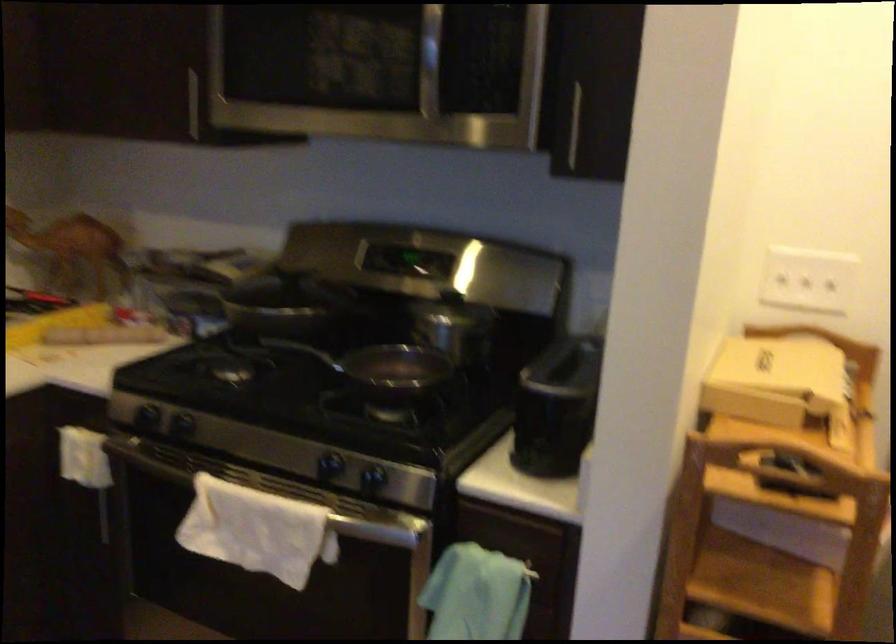
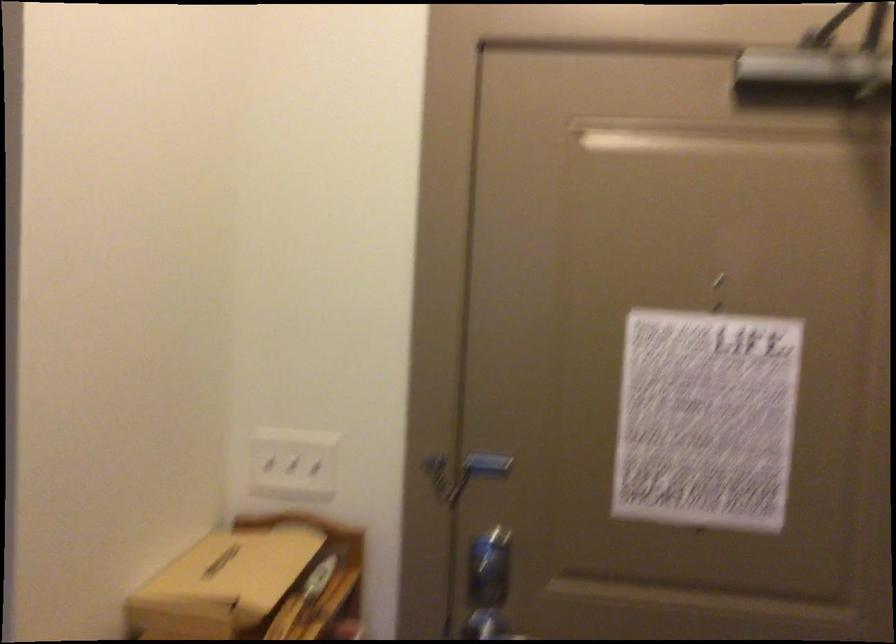
Question: What movement of the cameraman would produce the second image?

Choices:
 (A) Left
 (B) Right
 (C) Forward
 (D) Backward

Answer: (B)